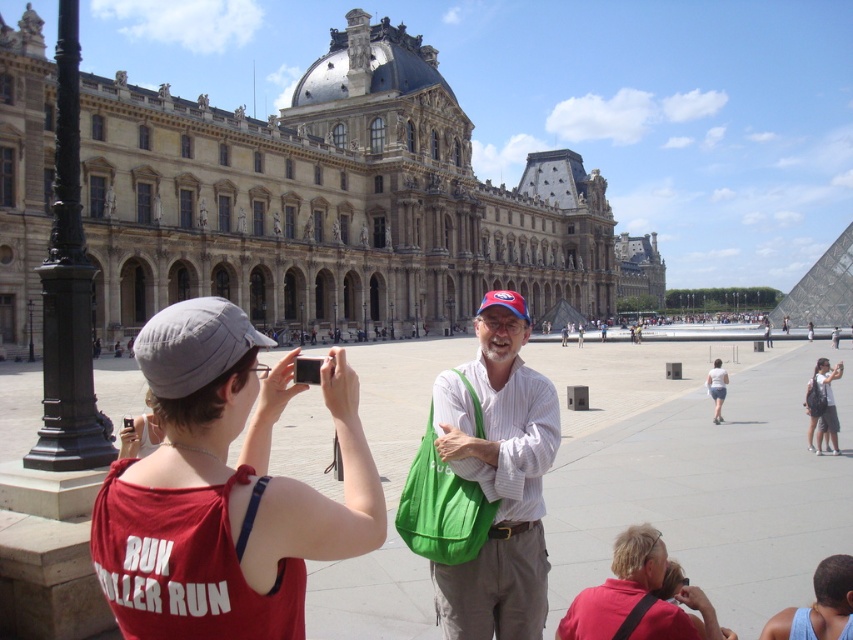
What is located at the coordinates point (819,605)?

The blue tank top at lower right is located at point (819,605).

In the scene shown: You are a photographer positioned in front of the Louvre Museum. You notice two people in the scene wearing a red cotton tank top at center and a matte white shirt at center. Which individual should you focus on to capture a clearer image of their clothing details?

The red cotton tank top at center is closer to the viewer than the matte white shirt at center, so focusing on the red cotton tank top at center will allow for a clearer image of its clothing details.

Looking at this image, you are a photographer trying to capture the blue tank top at lower right and the white cotton shorts at lower right in the same frame. Based on their positions, which clothing item would appear closer to the bottom of the photo?

The blue tank top at lower right appears closer to the bottom of the photo because it is positioned under the white cotton shorts at lower right.